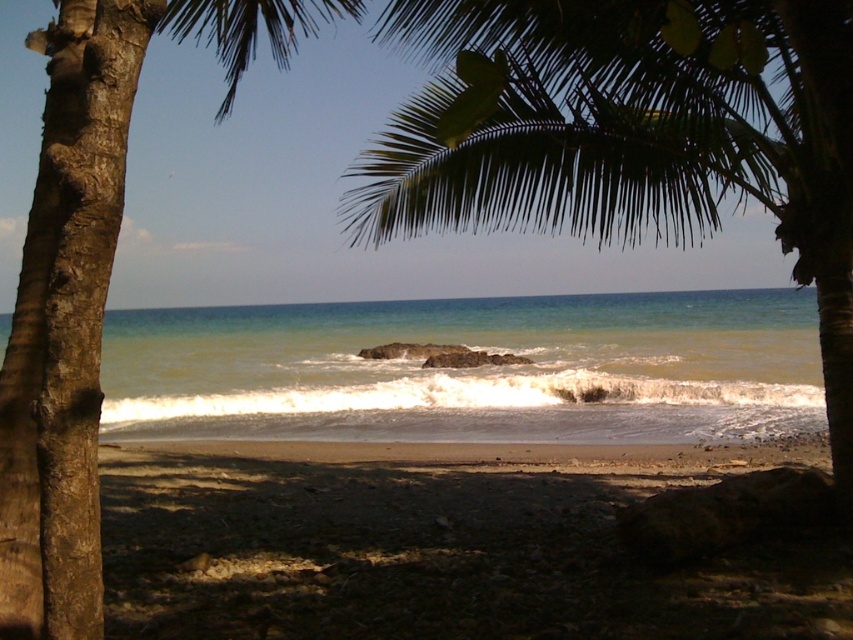
You are standing on the beach looking at the scene. Which palm tree, the green leafy palm tree at upper center or the brown rough bark palm tree at left, is positioned more to the east if the sun is setting in the west?

The green leafy palm tree at upper center is positioned more to the east because it is to the right of the brown rough bark palm tree at left, and since the sun is setting in the west, right would correspond to east.

You are a photographer trying to capture the palm trees in the scene. Which palm tree, the green leafy palm tree at upper center or the brown rough bark palm tree at left, would appear smaller in your photo?

The green leafy palm tree at upper center is smaller than the brown rough bark palm tree at left, so it would appear smaller in the photo.

You are standing at the palm tree trunk on the left side of the beach. You see a point marked at coordinates (x=471, y=369). Based on the scene description, can you determine if this point is located on the rocky outcrop or the greenish blue water at center?

The point at coordinates (x=471, y=369) is on the greenish blue water at center, not the rocky outcrop. The description states that the rocky outcrop is centrally located in the mid ground, while the water transitions from lighter turquoise near the shore to deeper blue further out. Since the point is specified to be on greenish blue water at center, it is part of the water area rather than the rocky outcrop.